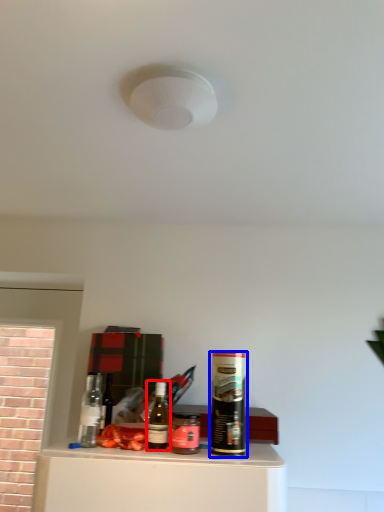
Question: Which object is closer to the camera taking this photo, bottle (highlighted by a red box) or beverage (highlighted by a blue box)?

Choices:
 (A) bottle
 (B) beverage

Answer: (B)